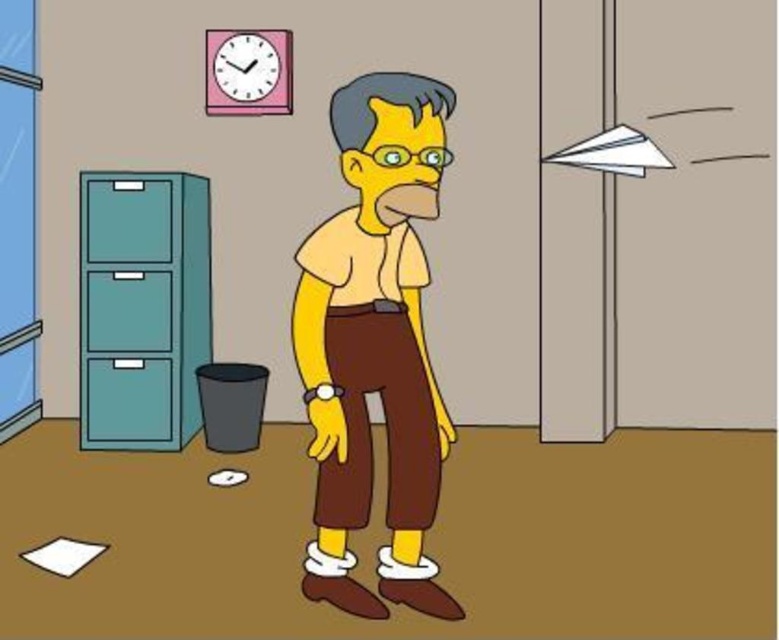
You are standing in the office scene and want to pick up two items located at the coordinates point (328, 592) and point (90, 300). Which item should you reach for first if you want to grab the one closer to you?

You should reach for the item at point (328, 592) first because it is closer to you than the item at point (90, 300) according to the spatial description provided.